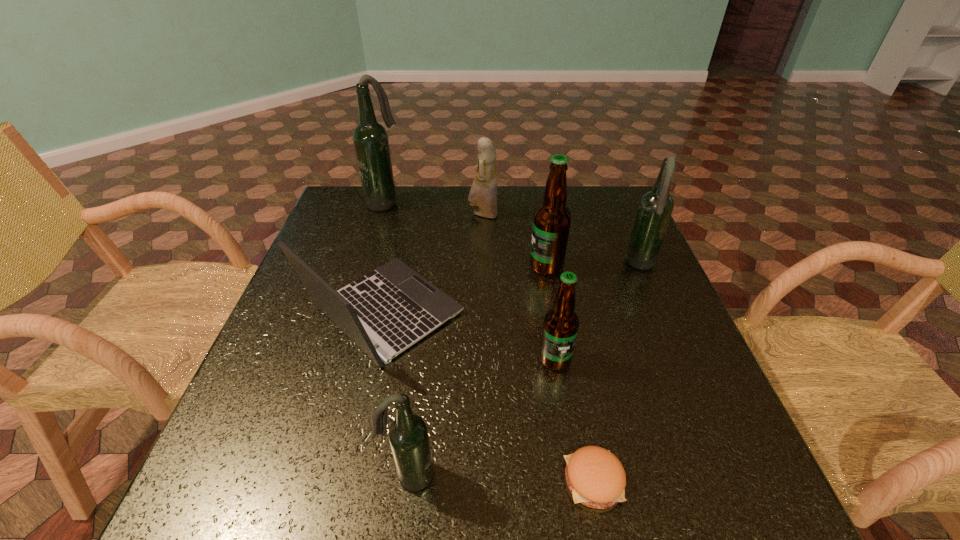
The image size is (960, 540). Find the location of `object that is at the right edge`. object that is at the right edge is located at coordinates pyautogui.click(x=655, y=208).

This screenshot has width=960, height=540. Find the location of `object situated at the far left corner`. object situated at the far left corner is located at coordinates (370, 138).

This screenshot has width=960, height=540. Find the location of `vacant space at the far edge of the desktop`. vacant space at the far edge of the desktop is located at coordinates (501, 193).

In the image, there is a desktop. Where is `vacant space at the left edge`? The height and width of the screenshot is (540, 960). vacant space at the left edge is located at coordinates (298, 326).

Locate an element on the screen. This screenshot has height=540, width=960. vacant space at the right edge of the desktop is located at coordinates (684, 424).

In the image, there is a desktop. Where is `blank space at the near left corner`? blank space at the near left corner is located at coordinates (298, 486).

Locate an element on the screen. vacant area at the far right corner of the desktop is located at coordinates (600, 197).

At what (x,y) coordinates should I click in order to perform the action: click on vacant area that lies between the smaller brown beer bottle and the laptop_computer. Please return your answer as a coordinate pair (x, y). Looking at the image, I should click on (469, 336).

Find the location of a particular element. vacant area that lies between the figurine and the shortest object is located at coordinates (539, 348).

This screenshot has height=540, width=960. I want to click on empty space between the tallest object and the nearer brown beer bottle, so click(469, 281).